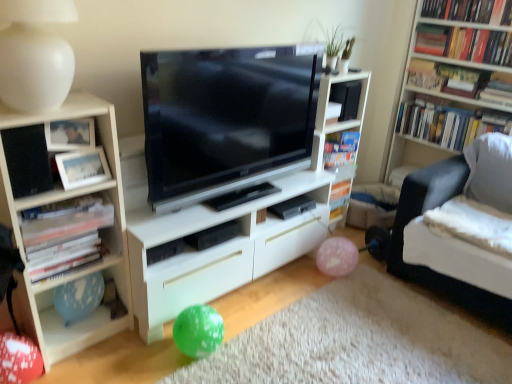
Measure the distance between hardcover books at upper right, the 5th book when ordered from bottom to top, and camera.

The depth of hardcover books at upper right, the 5th book when ordered from bottom to top, is 8.37 feet.

Describe the element at coordinates (225, 119) in the screenshot. The image size is (512, 384). I see `black glossy tv at center` at that location.

What is the approximate height of black glossy tv at center?

black glossy tv at center is 69.27 centimeters tall.

Image resolution: width=512 pixels, height=384 pixels. Describe the element at coordinates (456, 258) in the screenshot. I see `black fabric bean bag chair at right` at that location.

What is the approximate width of white matte bookshelf at left, which ranks as the 1th book in left-to-right order?

26.28 centimeters.

What do you see at coordinates (63, 227) in the screenshot?
I see `light wood bookcase at left` at bounding box center [63, 227].

Find the location of a particular element. hardcover books at upper right, the 5th book when ordered from bottom to top is located at coordinates (470, 11).

This screenshot has width=512, height=384. In the image, there is a hardcover books at upper right, placed as the 3th book when sorted from top to bottom. Identify the location of lamp below it (from the image's perspective). (35, 54).

Which is closer, (23, 62) or (459, 113)?

The point (23, 62) is closer.

Can you tell me how much white matte lamp at upper left and hardcover books at upper right, placed as the 3th book when sorted from top to bottom, differ in facing direction?

They differ by 90.4 degrees in their facing directions.

Which object is positioned more to the left, white matte lamp at upper left or hardcover books at upper right, positioned as the 2th book in right-to-left order?

white matte lamp at upper left.

Considering the relative positions of white wood bookshelf at upper right, which is counted as the first shelf, starting from the right, and matte white picture frame at upper left, the 1th picture frame from the top, in the image provided, is white wood bookshelf at upper right, which is counted as the first shelf, starting from the right, to the right of matte white picture frame at upper left, the 1th picture frame from the top, from the viewer's perspective?

Correct, you'll find white wood bookshelf at upper right, which is counted as the first shelf, starting from the right, to the right of matte white picture frame at upper left, the 1th picture frame from the top.

Measure the distance from white wood bookshelf at upper right, which is counted as the first shelf, starting from the right, to matte white picture frame at upper left, the 1th picture frame from the top.

A distance of 2.39 meters exists between white wood bookshelf at upper right, which is counted as the first shelf, starting from the right, and matte white picture frame at upper left, the 1th picture frame from the top.

Is matte white picture frame at upper left, acting as the 2th picture frame starting from the bottom, inside white wood bookshelf at upper right, the third shelf from the left?

No, matte white picture frame at upper left, acting as the 2th picture frame starting from the bottom, is not a part of white wood bookshelf at upper right, the third shelf from the left.

From the image's perspective, is white wood bookshelf at upper right, the third shelf from the left, positioned above or below matte white picture frame at upper left, acting as the 2th picture frame starting from the bottom?

From the image's perspective, white wood bookshelf at upper right, the third shelf from the left, appears above matte white picture frame at upper left, acting as the 2th picture frame starting from the bottom.

Considering the relative sizes of black matte speaker at upper right, the first speaker from the back, and hardcover book at upper right, the 2th book from the left, in the image provided, is black matte speaker at upper right, the first speaker from the back, taller than hardcover book at upper right, the 2th book from the left,?

Correct, black matte speaker at upper right, the first speaker from the back, is much taller as hardcover book at upper right, the 2th book from the left.

Which is more to the right, black matte speaker at upper right, which is the 2th speaker in front-to-back order, or hardcover book at upper right, which is the 4th book in right-to-left order?

black matte speaker at upper right, which is the 2th speaker in front-to-back order.

Who is bigger, black matte speaker at upper right, the first speaker from the back, or hardcover book at upper right, which ranks as the fourth book in top-to-bottom order?

Bigger between the two is black matte speaker at upper right, the first speaker from the back.

Locate an element on the screen. Image resolution: width=512 pixels, height=384 pixels. the 2nd book below the black matte speaker at upper right, which ranks as the second speaker in bottom-to-top order (from the image's perspective) is located at coordinates (340, 148).

Is hardcover books at upper right, positioned as the 2th book in right-to-left order, positioned beyond the bounds of white matte bookshelf at left, which is counted as the fifth book, starting from the top?

hardcover books at upper right, positioned as the 2th book in right-to-left order, lies outside white matte bookshelf at left, which is counted as the fifth book, starting from the top,'s area.

From the image's perspective, would you say hardcover books at upper right, placed as the 3th book when sorted from top to bottom, is positioned over white matte bookshelf at left, which is counted as the fifth book, starting from the top?

Yes, from the image's perspective, hardcover books at upper right, placed as the 3th book when sorted from top to bottom, is on top of white matte bookshelf at left, which is counted as the fifth book, starting from the top.

Is hardcover books at upper right, which is counted as the 4th book, starting from the left, far from white matte bookshelf at left, acting as the fifth book starting from the right?

Yes, hardcover books at upper right, which is counted as the 4th book, starting from the left, and white matte bookshelf at left, acting as the fifth book starting from the right, are quite far apart.

In the scene shown: From a real-world perspective, who is located higher, white matte shelf at center, acting as the third shelf starting from the right, or white matte lamp at upper left?

From a 3D spatial view, white matte lamp at upper left is above.

From the image's perspective, is white matte shelf at center, acting as the third shelf starting from the right, below white matte lamp at upper left?

Yes, from the image's perspective, white matte shelf at center, acting as the third shelf starting from the right, is beneath white matte lamp at upper left.

Would you say white matte shelf at center, which appears as the first shelf when viewed from the left, is to the left or to the right of white matte lamp at upper left in the picture?

In the image, white matte shelf at center, which appears as the first shelf when viewed from the left, appears on the right side of white matte lamp at upper left.

From the picture: Can we say black glossy tv at center lies outside white wood bookshelf at upper right, which is counted as the first shelf, starting from the right?

That's correct, black glossy tv at center is outside of white wood bookshelf at upper right, which is counted as the first shelf, starting from the right.

Is black glossy tv at center to the left of white wood bookshelf at upper right, the third shelf from the left, from the viewer's perspective?

Correct, you'll find black glossy tv at center to the left of white wood bookshelf at upper right, the third shelf from the left.

Locate an element on the screen. television above the white wood bookshelf at upper right, the third shelf from the left (from a real-world perspective) is located at coordinates (225, 119).

Which is further, (458, 9) or (412, 158)?

The point (412, 158) is behind.

Considering the sizes of objects hardcover books at upper right, marked as the third book in a left-to-right arrangement, and white wood bookshelf at upper right, the third shelf from the left, in the image provided, who is wider, hardcover books at upper right, marked as the third book in a left-to-right arrangement, or white wood bookshelf at upper right, the third shelf from the left,?

white wood bookshelf at upper right, the third shelf from the left, is wider.

Locate an element on the screen. The height and width of the screenshot is (384, 512). the 5th book behind when counting from the white matte lamp at upper left is located at coordinates (448, 122).

Identify the location of the 1st picture frame positioned below the white wood bookshelf at upper right, which is counted as the first shelf, starting from the right (from the image's perspective). (70, 134).

Based on their spatial positions, is hardcover books at upper right, placed as the 3th book when sorted from top to bottom, or pink dotted balloon at lower right, positioned as the second balloon in left-to-right order, closer to black matte paperback book at center?

Among the two, pink dotted balloon at lower right, positioned as the second balloon in left-to-right order, is located nearer to black matte paperback book at center.

Looking at the image, which one is located closer to matte black speaker at left, which is the second speaker from back to front, hardcover books at upper right, acting as the 3th book starting from the bottom, or black fabric bean bag chair at right?

black fabric bean bag chair at right is closer to matte black speaker at left, which is the second speaker from back to front.

Considering their positions, is hardcover books at upper right, marked as the third book in a left-to-right arrangement, positioned further to matte black speaker at left, which ranks as the 2th speaker in top-to-bottom order, than matte white picture frame at upper left, positioned as the second picture frame in top-to-bottom order?

hardcover books at upper right, marked as the third book in a left-to-right arrangement, is further to matte black speaker at left, which ranks as the 2th speaker in top-to-bottom order.

From the image, which object appears to be nearer to hardcover books at upper right, placed as the 3th book when sorted from top to bottom, hardcover books at upper right, the 5th book when ordered from bottom to top, or white matte bookshelf at left, placed as the 1th book when sorted from bottom to top?

The object closer to hardcover books at upper right, placed as the 3th book when sorted from top to bottom, is hardcover books at upper right, the 5th book when ordered from bottom to top.

In the scene shown: When comparing their distances from red dotted balloon at lower left, which is counted as the 1th balloon, starting from the left, does white matte lamp at upper left or matte black speaker at left, the 1th speaker viewed from the front, seem closer?

matte black speaker at left, the 1th speaker viewed from the front, is closer to red dotted balloon at lower left, which is counted as the 1th balloon, starting from the left.

When comparing their distances from black matte paperback book at center, does light wood bookcase at left or pink dotted balloon at lower right, which ranks as the 1th balloon in right-to-left order, seem further?

light wood bookcase at left lies further to black matte paperback book at center than the other object.

Based on their spatial positions, is white wood bookshelf at upper right, which is counted as the first shelf, starting from the right, or matte white picture frame at upper left, acting as the 2th picture frame starting from the bottom, closer to hardcover book at upper right, the 2th book from the left?

white wood bookshelf at upper right, which is counted as the first shelf, starting from the right, is closer to hardcover book at upper right, the 2th book from the left.

Which object lies nearer to the anchor point white matte bookshelf at left, which ranks as the 1th book in left-to-right order, red dotted balloon at lower left, which is counted as the first balloon, starting from the front, or hardcover books at upper right, the 5th book when ordered from bottom to top?

red dotted balloon at lower left, which is counted as the first balloon, starting from the front, is closer to white matte bookshelf at left, which ranks as the 1th book in left-to-right order.

Identify the location of speaker between red dotted balloon at lower left, which is counted as the 1th balloon, starting from the left, and green matte balloon at lower center, in the horizontal direction. (27, 160).

Find the location of a particular element. speaker between matte white picture frame at upper left, acting as the 2th picture frame starting from the bottom, and light wood bookcase at left, in the vertical direction is located at coordinates (27, 160).

This screenshot has width=512, height=384. What are the coordinates of `bookcase situated between matte black speaker at left, placed as the 2th speaker when sorted from right to left, and white wood bookshelf at upper right, the third shelf from the left, from left to right` in the screenshot? It's located at (63, 227).

Find the location of a particular element. This screenshot has width=512, height=384. lamp situated between light wood bookcase at left and white matte shelf at center, placed as the second shelf when sorted from right to left, from left to right is located at coordinates (35, 54).